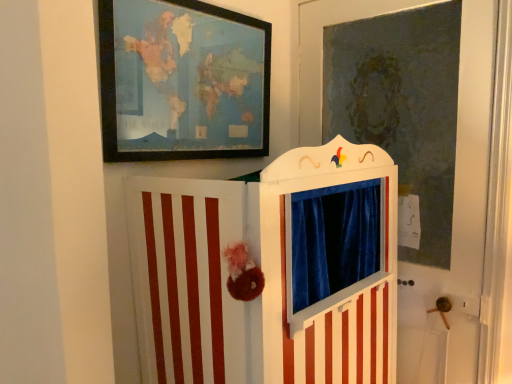
Question: Can you confirm if velvet blue curtain at upper center is positioned to the left of wooden framed map at upper left?

Choices:
 (A) no
 (B) yes

Answer: (A)

Question: Considering the relative sizes of velvet blue curtain at upper center and wooden framed map at upper left in the image provided, is velvet blue curtain at upper center taller than wooden framed map at upper left?

Choices:
 (A) no
 (B) yes

Answer: (B)

Question: Does velvet blue curtain at upper center have a greater width compared to wooden framed map at upper left?

Choices:
 (A) no
 (B) yes

Answer: (B)

Question: Is velvet blue curtain at upper center positioned in front of wooden framed map at upper left?

Choices:
 (A) yes
 (B) no

Answer: (B)

Question: Does velvet blue curtain at upper center turn towards wooden framed map at upper left?

Choices:
 (A) no
 (B) yes

Answer: (B)

Question: From a real-world perspective, relative to velvet blue curtain at upper center, is wooden framed map at upper left vertically above or below?

Choices:
 (A) above
 (B) below

Answer: (A)

Question: Is wooden framed map at upper left in front of or behind velvet blue curtain at upper center in the image?

Choices:
 (A) front
 (B) behind

Answer: (A)

Question: Looking at the image, does wooden framed map at upper left seem bigger or smaller compared to velvet blue curtain at upper center?

Choices:
 (A) small
 (B) big

Answer: (A)

Question: From the image's perspective, relative to velvet blue curtain at upper center, is wooden framed map at upper left above or below?

Choices:
 (A) above
 (B) below

Answer: (A)

Question: In terms of height, does white striped puppet theater at center look taller or shorter compared to velvet blue curtain at upper center?

Choices:
 (A) tall
 (B) short

Answer: (B)

Question: Is white striped puppet theater at center inside the boundaries of velvet blue curtain at upper center, or outside?

Choices:
 (A) inside
 (B) outside

Answer: (B)

Question: Is point (369, 317) positioned closer to the camera than point (415, 6)?

Choices:
 (A) closer
 (B) farther

Answer: (A)

Question: Looking at the image, does white striped puppet theater at center seem bigger or smaller compared to velvet blue curtain at upper center?

Choices:
 (A) small
 (B) big

Answer: (B)

Question: Is point (202, 122) positioned closer to the camera than point (369, 200)?

Choices:
 (A) closer
 (B) farther

Answer: (B)

Question: From the image's perspective, is wooden framed map at upper left located above or below white striped puppet theater at center?

Choices:
 (A) below
 (B) above

Answer: (B)